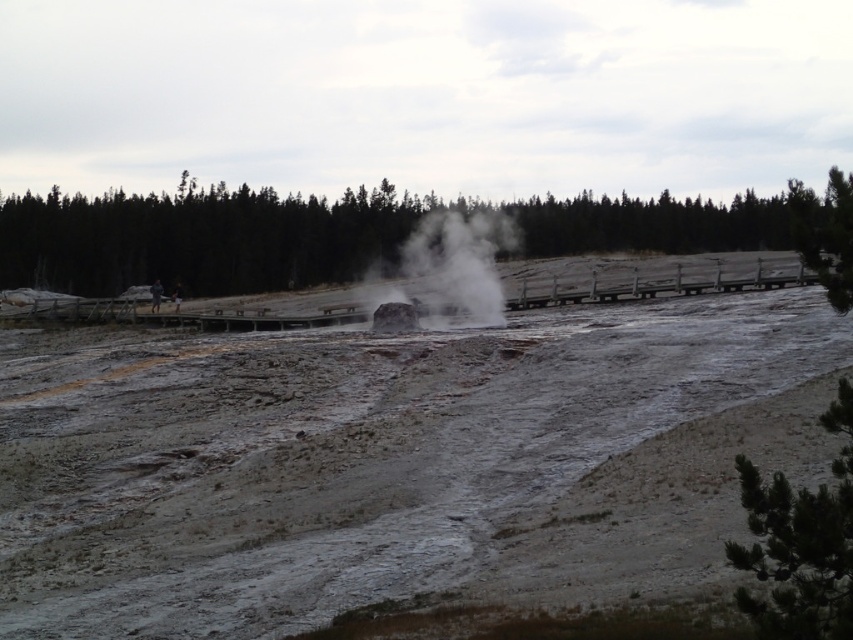
Can you confirm if steamy mud at center is positioned to the right of white vapor at center?

No, steamy mud at center is not to the right of white vapor at center.

Does steamy mud at center have a greater width compared to white vapor at center?

Yes.

Between point (527, 392) and point (412, 268), which one is positioned behind?

The point (412, 268) is more distant.

Locate an element on the screen. steamy mud at center is located at coordinates (335, 451).

Can you confirm if green leafy tree at upper center is thinner than green pine tree at lower right?

In fact, green leafy tree at upper center might be wider than green pine tree at lower right.

Can you confirm if green leafy tree at upper center is wider than green pine tree at lower right?

Indeed, green leafy tree at upper center has a greater width compared to green pine tree at lower right.

Find the location of a particular element. The width and height of the screenshot is (853, 640). green leafy tree at upper center is located at coordinates (201, 240).

Is the position of green leafy tree at upper center less distant than that of white vapor at center?

Yes.

Describe the element at coordinates (201, 240) in the screenshot. I see `green leafy tree at upper center` at that location.

Find the location of `green leafy tree at upper center`. green leafy tree at upper center is located at coordinates (201, 240).